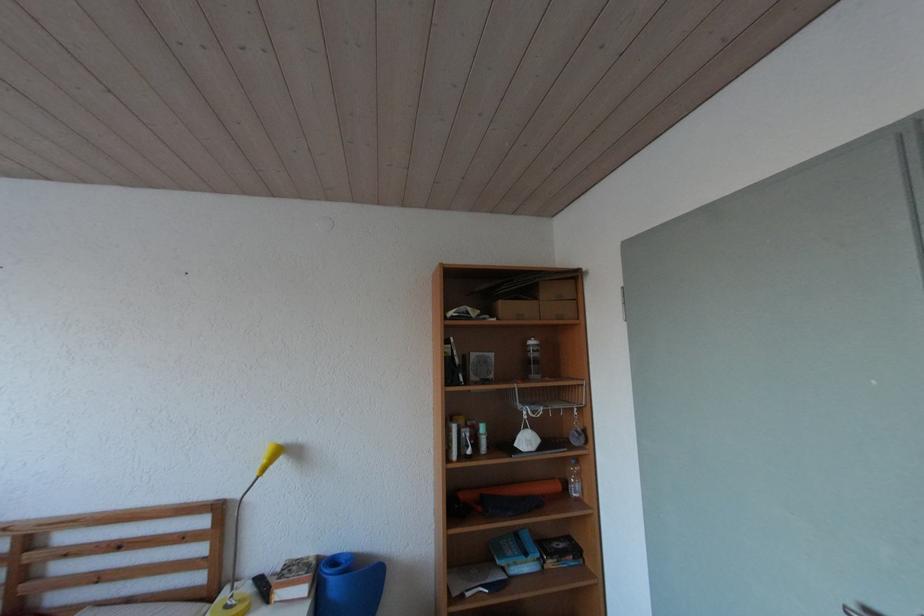
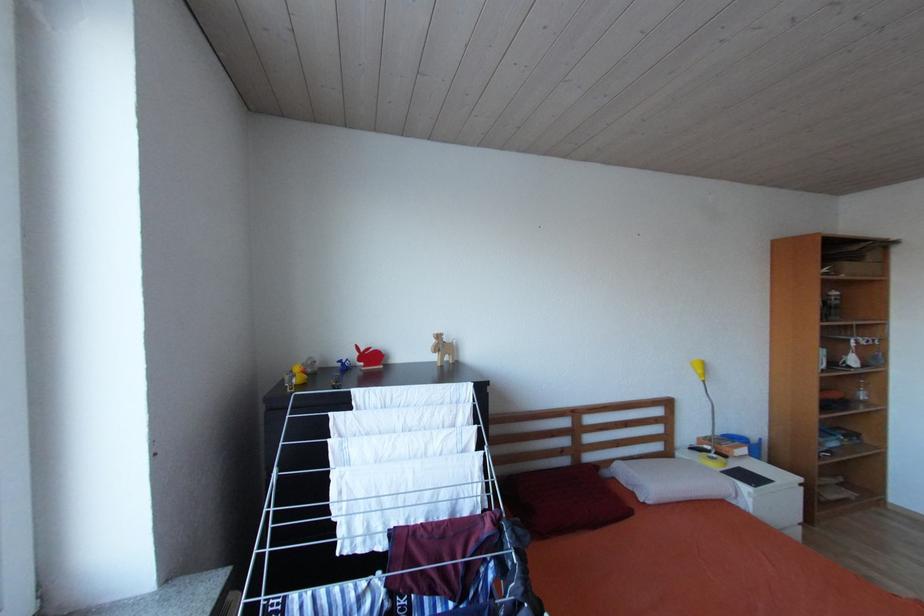
Question: Which direction would the cameraman need to move to produce the second image? Reply with the corresponding letter.

Choices:
 (A) Left
 (B) Right
 (C) Forward
 (D) Backward

Answer: (A)